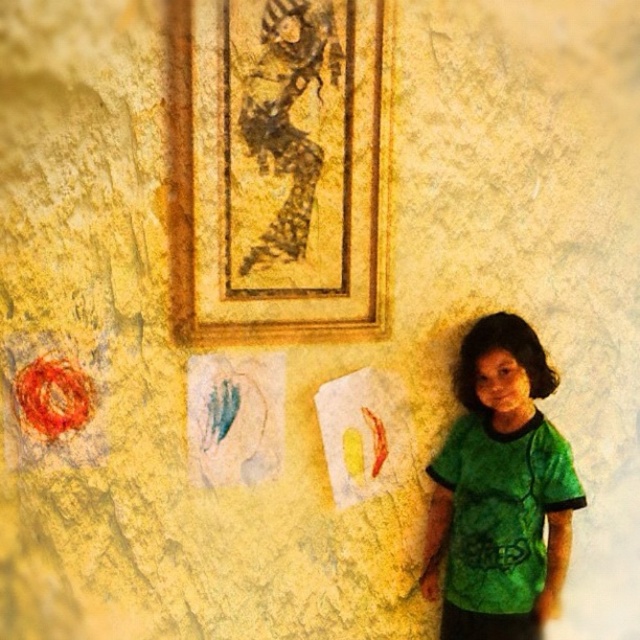
Question: In this image, where is gold textured picture frame at upper center located relative to green tie-dye shirt at right?

Choices:
 (A) right
 (B) left

Answer: (B)

Question: Does gold textured picture frame at upper center have a lesser width compared to green tie-dye shirt at right?

Choices:
 (A) no
 (B) yes

Answer: (A)

Question: Which point is farther to the camera?

Choices:
 (A) green tie-dye shirt at right
 (B) gold textured picture frame at upper center

Answer: (A)

Question: Can you confirm if gold textured picture frame at upper center is positioned to the right of green tie-dye shirt at right?

Choices:
 (A) yes
 (B) no

Answer: (B)

Question: Among these objects, which one is nearest to the camera?

Choices:
 (A) gold textured picture frame at upper center
 (B) green tie-dye shirt at right

Answer: (A)